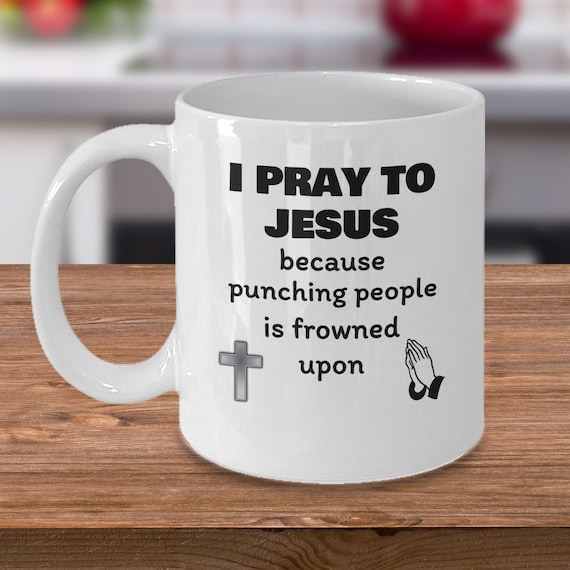
Where is `bottom edge of white mug on table, center bottom`? bottom edge of white mug on table, center bottom is located at coordinates (199, 450), (270, 500), (401, 494), (451, 475), (479, 437).